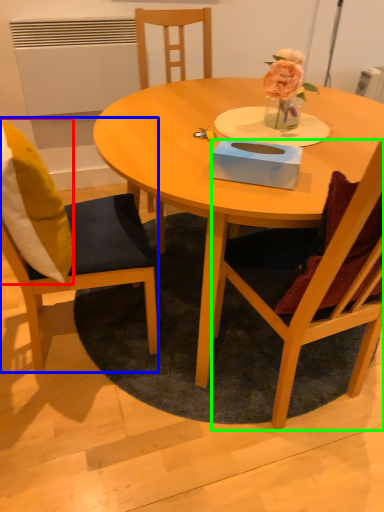
Question: Considering the real-world distances, which object is closest to pillow (highlighted by a red box)? chair (highlighted by a blue box) or chair (highlighted by a green box).

Choices:
 (A) chair
 (B) chair

Answer: (A)